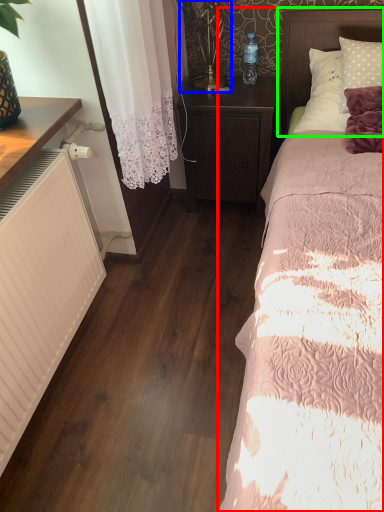
Question: Which is nearer to the bed (highlighted by a red box)? table lamp (highlighted by a blue box) or headboard (highlighted by a green box).

Choices:
 (A) table lamp
 (B) headboard

Answer: (B)